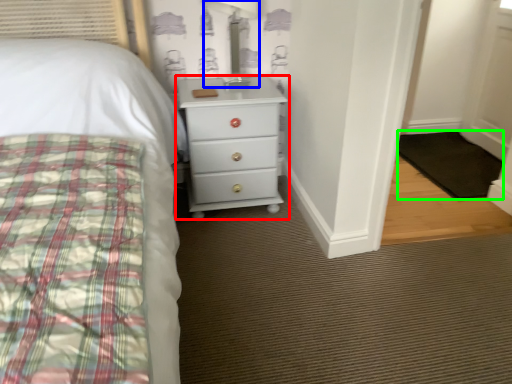
Question: Which object is the closest to the chest of drawers (highlighted by a red box)? Choose among these: table lamp (highlighted by a blue box) or mat (highlighted by a green box).

Choices:
 (A) table lamp
 (B) mat

Answer: (A)